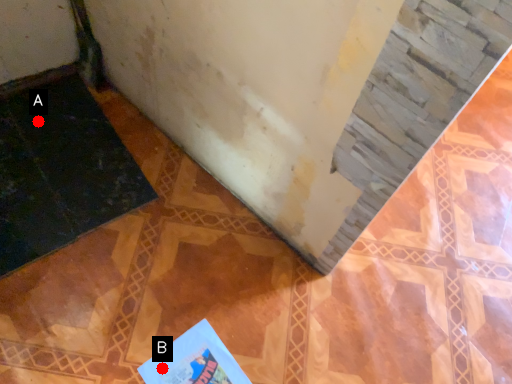
Question: Two points are circled on the image, labeled by A and B beside each circle. Which point is closer to the camera taking this photo?

Choices:
 (A) A is closer
 (B) B is closer

Answer: (B)